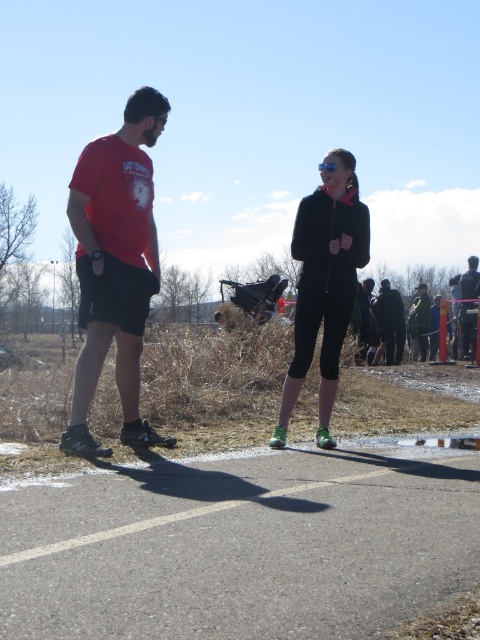
Question: Does black matte jacket at center appear over matte black shorts at center?

Choices:
 (A) no
 (B) yes

Answer: (A)

Question: Which object is the closest to the khaki cotton jacket at center?

Choices:
 (A) black fleece jacket at center
 (B) matte black shorts at center
 (C) matte red t-shirt at left

Answer: (B)

Question: Considering the relative positions of matte red t-shirt at left and black fleece jacket at center in the image provided, where is matte red t-shirt at left located with respect to black fleece jacket at center?

Choices:
 (A) below
 (B) above

Answer: (B)

Question: Estimate the real-world distances between objects in this image. Which object is farther from the khaki cotton jacket at center?

Choices:
 (A) black fleece jacket at center
 (B) black matte jacket at center
 (C) matte red t-shirt at left

Answer: (C)

Question: Which point is closer to the camera?

Choices:
 (A) matte red t-shirt at left
 (B) khaki cotton jacket at center
 (C) black fleece jacket at center

Answer: (A)

Question: Is black fleece jacket at center wider than black matte jacket at center?

Choices:
 (A) yes
 (B) no

Answer: (B)